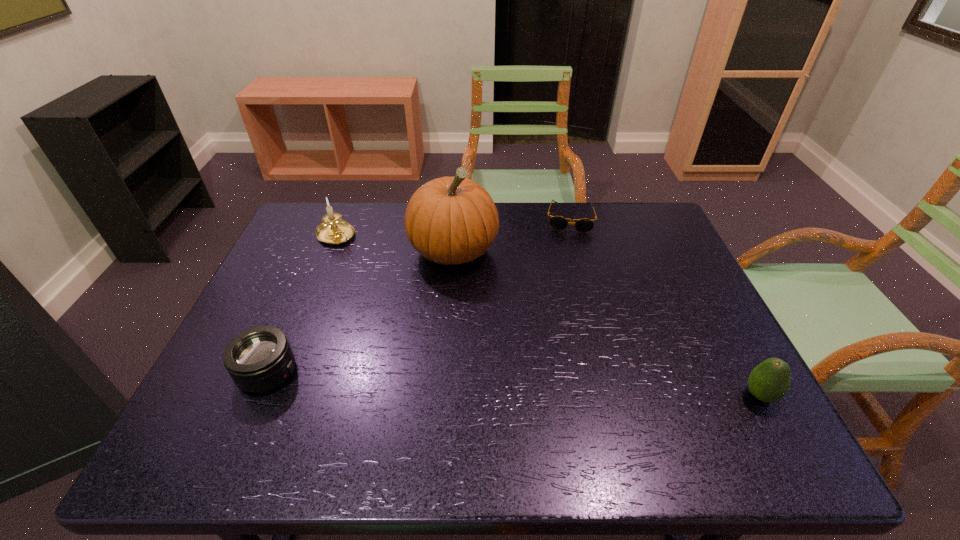
Identify the location of free spot that satisfies the following two spatial constraints: 1. on the front side of the third tallest object; 2. on the left side of the tallest object. The image size is (960, 540). (443, 395).

At what (x,y) coordinates should I click in order to perform the action: click on vacant space that satisfies the following two spatial constraints: 1. on the back side of the fourth object from left to right; 2. on the left side of the third object from left to right. Please return your answer as a coordinate pair (x, y). This screenshot has width=960, height=540. Looking at the image, I should click on (456, 218).

At what (x,y) coordinates should I click in order to perform the action: click on free location that satisfies the following two spatial constraints: 1. on the front side of the fourth shortest object; 2. on the right side of the third object from right to left. Please return your answer as a coordinate pair (x, y). Looking at the image, I should click on (329, 251).